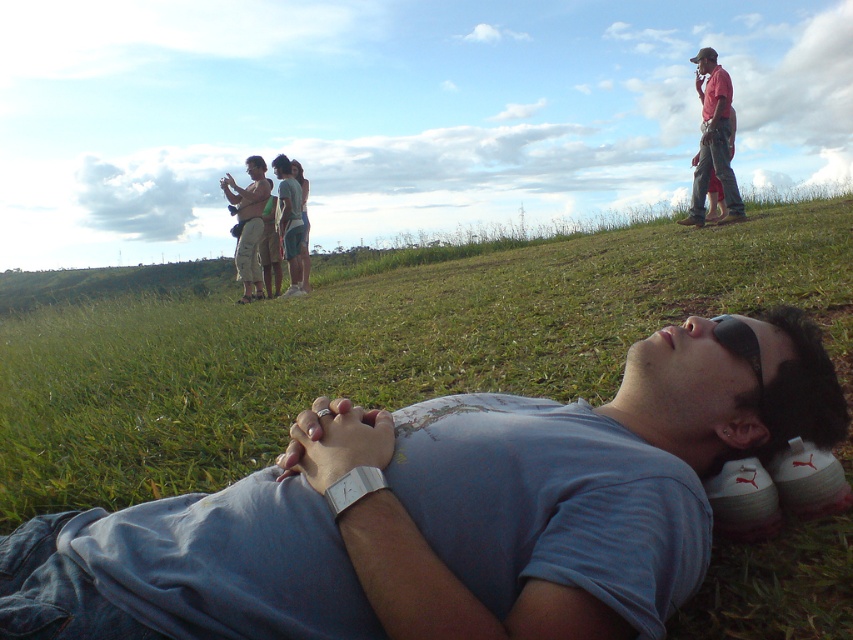
You are standing at point [257,225] and want to walk to the person lying on the grassy hill. Which direction should you go relative to point [392,477]?

You should walk towards point [392,477], which is in front of point [257,225], to reach the person lying on the grassy hill.

You are a photographer positioned at the lower left corner of the image. You want to take a photo of the matte pink shirt at upper right. Which direction should you move your camera to frame it properly?

The matte pink shirt at upper right is located at coordinates point (x=712, y=140), so you should move your camera to the upper right direction to frame it properly.